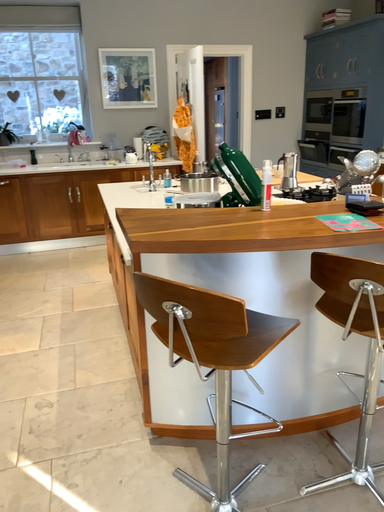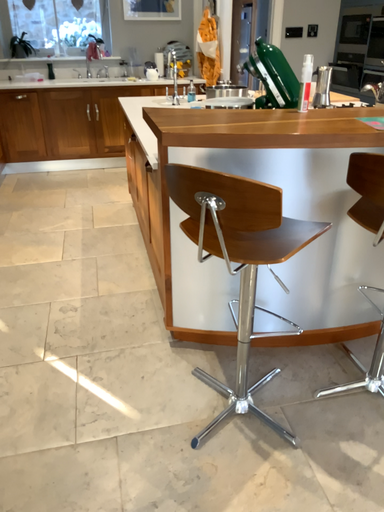
Question: Which way did the camera rotate in the video?

Choices:
 (A) rotated downward
 (B) rotated upward

Answer: (A)